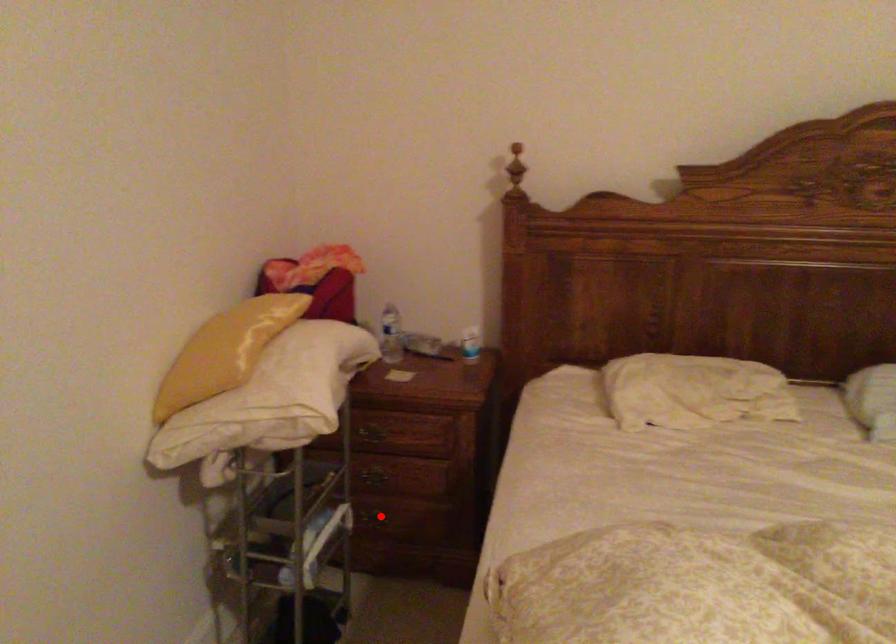
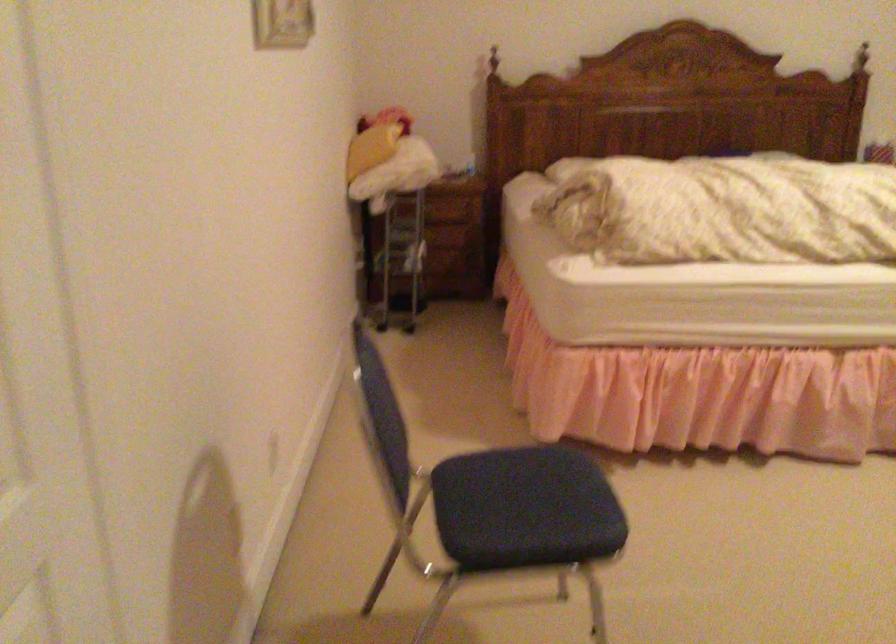
Question: I am providing you with two images of the same scene from different viewpoints. A red point is marked on the first image. Can you still see the location of the red point in image 2?

Choices:
 (A) Yes
 (B) No

Answer: (B)